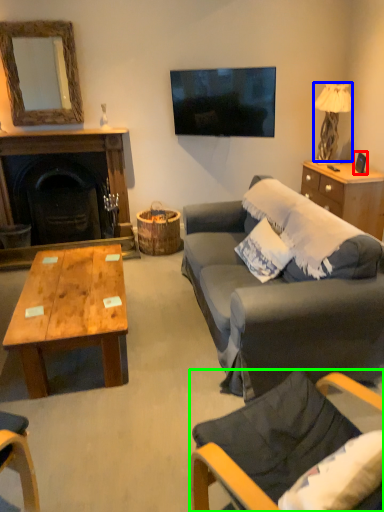
Question: Estimate the real-world distances between objects in this image. Which object is farther from picture frame (highlighted by a red box), lamp (highlighted by a blue box) or chair (highlighted by a green box)?

Choices:
 (A) lamp
 (B) chair

Answer: (B)